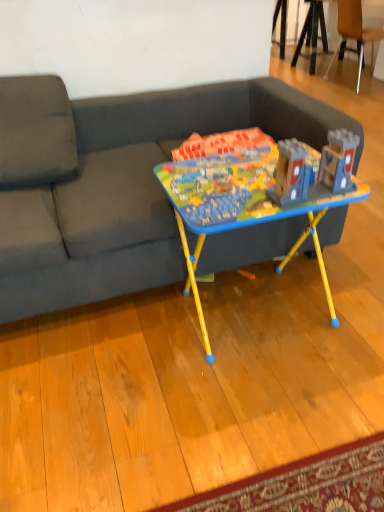
Where is `free space that is in between matte plastic table at center and dark gray fabric couch at center`? This screenshot has height=512, width=384. free space that is in between matte plastic table at center and dark gray fabric couch at center is located at coordinates (153, 329).